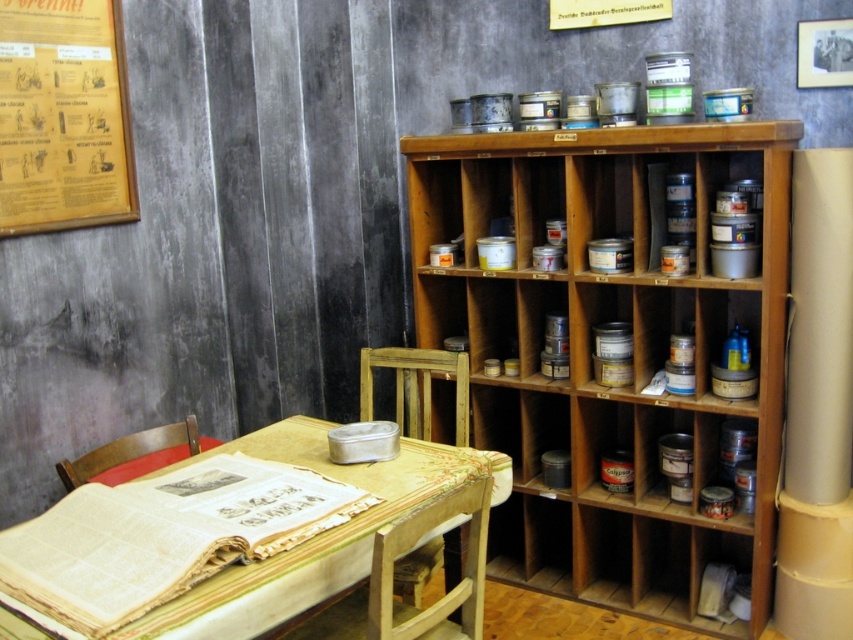
You are standing in a workshop and need to place a tool on the wooden shelves at center. Where exactly should you place it?

You should place the tool at point (590, 349) on the wooden shelves at center as specified.

You are organizing a workshop and need to place a new tool on the wooden shelves at center or the wooden table at center. Which location is to the right side of the room?

The wooden shelves at center are to the right of the wooden table at center, so the wooden shelves at center are on the right side of the room.

You are a delivery person who needs to place a large package between the wooden shelves at center and the wall. The package is 2 meters long. Can you fit it there?

The space between the wooden shelves at center and the wall is 2.33 meters, so the package which is 2 meters long can fit as it is shorter than the available space.